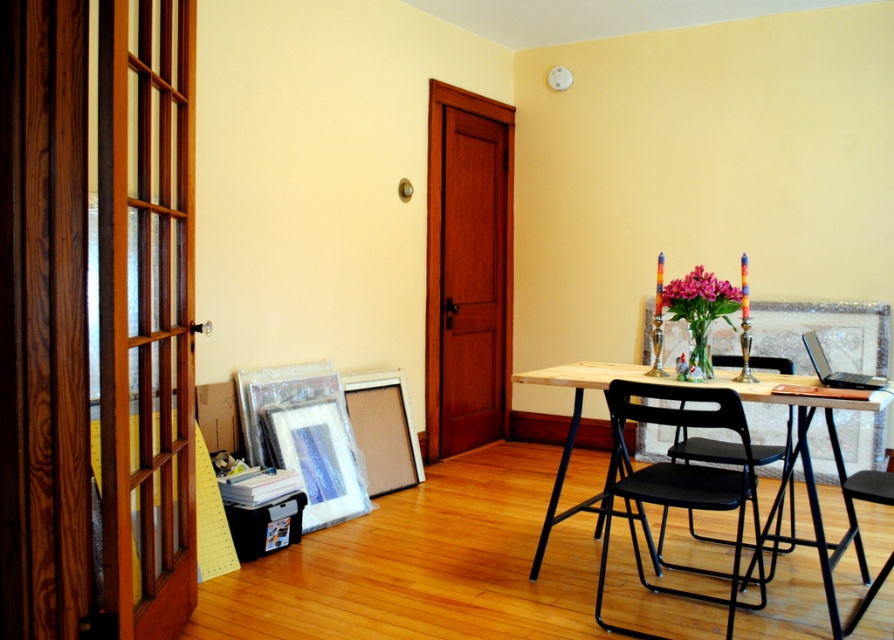
You are a person who is 1.7 meters tall. You want to sit on one of the chairs in the room. Which chair, the black plastic chair at center or the black plastic chair at right, would be more comfortable for you to sit on without needing to adjust its height?

The black plastic chair at center is much taller than the black plastic chair at right. Since you are 1.7 meters tall, the taller chair might provide better comfort as it likely has a higher seat height that aligns with your body proportions, reducing strain when sitting.

You are a person with a 10 inch wide backpack. You want to sit on the black plastic chair at center and place your backpack between the chair and the wooden table at center. Will your backpack fit in that space?

The distance between the black plastic chair at center and the wooden table at center is 9.42 inches. Since your backpack is 10 inches wide, it won t fit in that space.